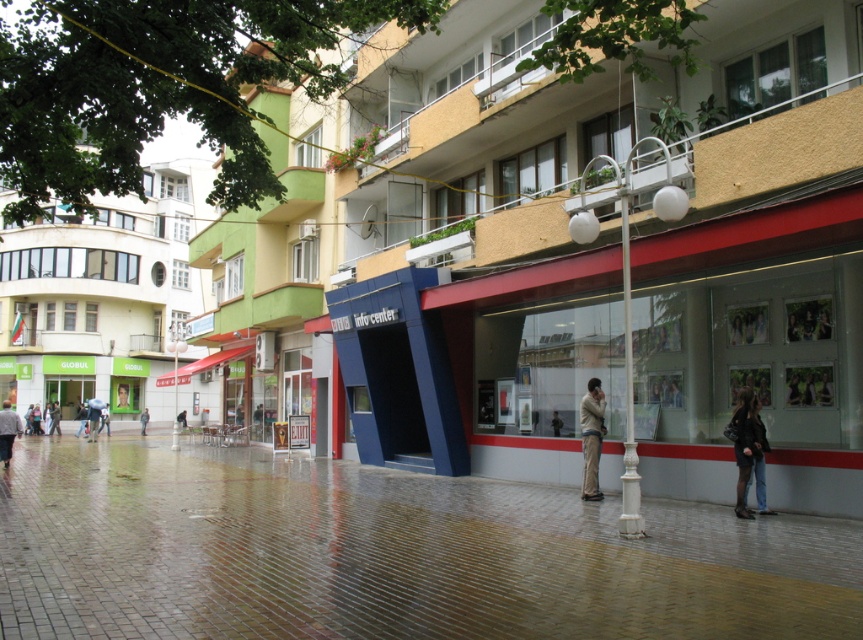
From the picture: You are a tailor observing two jackets on a rack in the center of the scene. The jackets are a dark gray jacket at center and a light brown leather jacket at center. Which jacket would require more fabric to make?

The dark gray jacket at center has a larger size compared to the light brown leather jacket at center, so it would require more fabric to make.